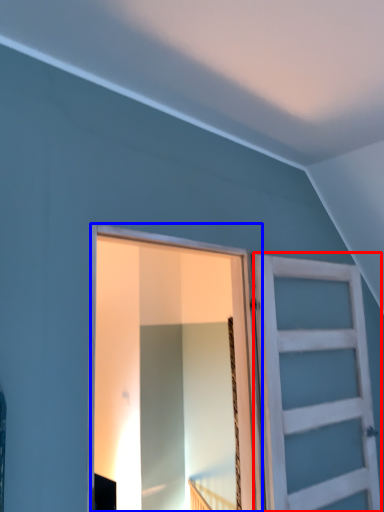
Question: Which object is further to the camera taking this photo, barn door (highlighted by a red box) or barn door (highlighted by a blue box)?

Choices:
 (A) barn door
 (B) barn door

Answer: (A)